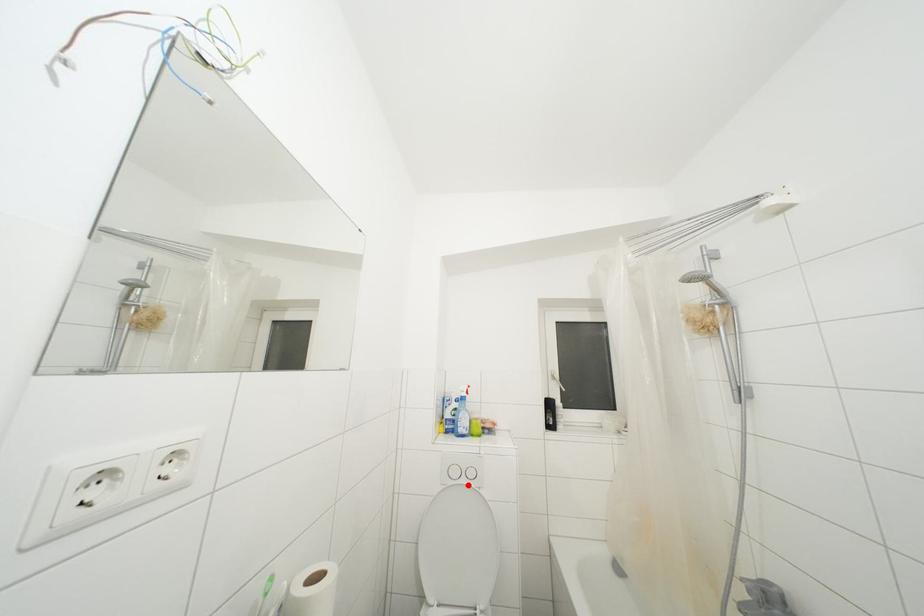
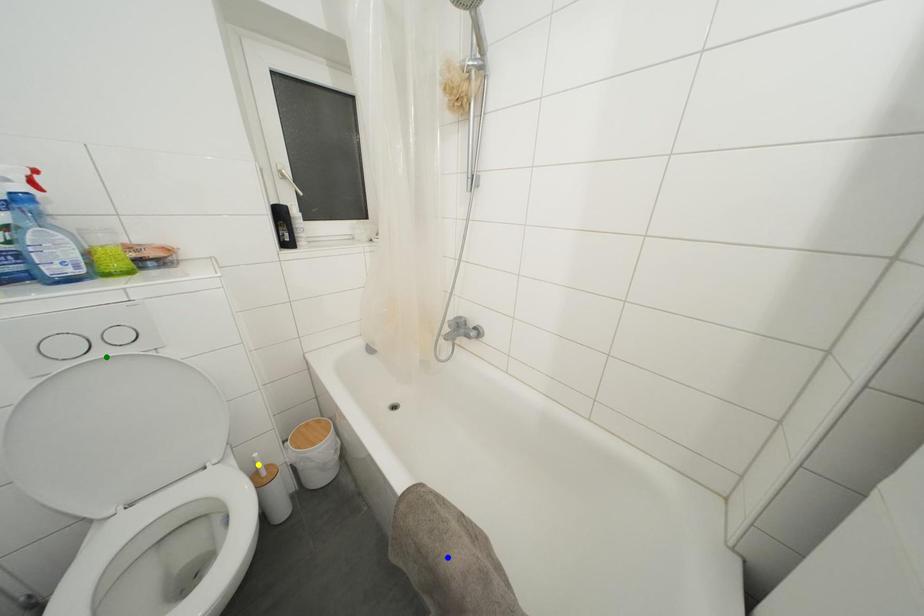
Question: I am providing you with two images of the same scene from different viewpoints. A red point is marked on the first image. You are given multiple points on the second image. Which spot in image 2 lines up with the point in image 1?

Choices:
 (A) blue point
 (B) yellow point
 (C) green point

Answer: (C)